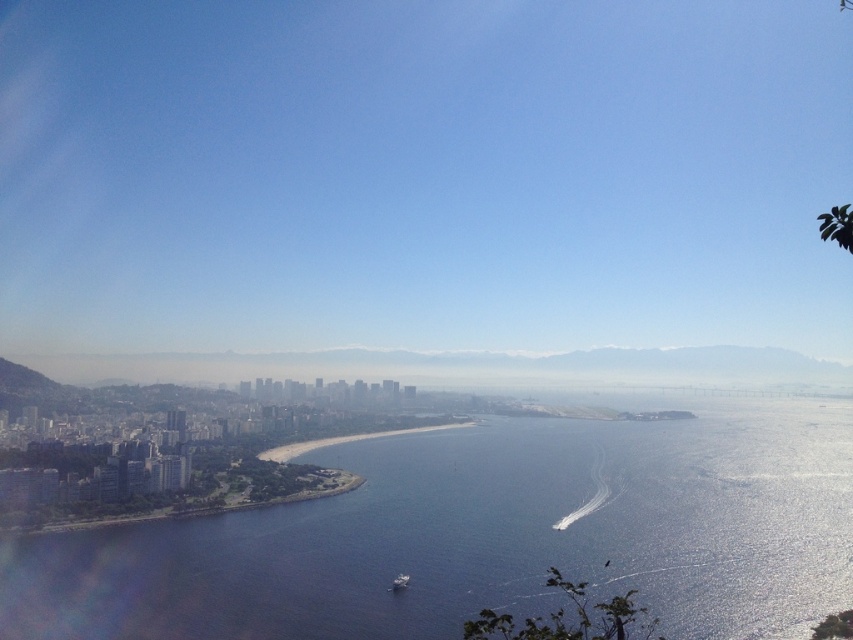
Between point (328, 442) and point (404, 577), which one is positioned in front?

Point (404, 577) is in front.

Who is lower down, golden sand beach at center or metallic gray boat at lower center?

metallic gray boat at lower center is lower down.

Measure the distance between point (x=338, y=444) and camera.

Point (x=338, y=444) is 638.35 meters away from camera.

Where is `golden sand beach at center`? The width and height of the screenshot is (853, 640). golden sand beach at center is located at coordinates (350, 440).

Between blue liquid water at lower left and golden sand beach at center, which one is positioned higher?

golden sand beach at center

Which is in front, point (821, 440) or point (300, 445)?

Point (300, 445)

Which is in front, point (666, 560) or point (277, 449)?

Point (277, 449) is in front.

This screenshot has height=640, width=853. Identify the location of blue liquid water at lower left. (485, 536).

Based on the photo, can you confirm if blue liquid water at lower left is smaller than metallic gray boat at lower center?

Incorrect, blue liquid water at lower left is not smaller in size than metallic gray boat at lower center.

Measure the distance between blue liquid water at lower left and camera.

blue liquid water at lower left and camera are 627.60 meters apart from each other.

Locate an element on the screen. This screenshot has width=853, height=640. blue liquid water at lower left is located at coordinates (485, 536).